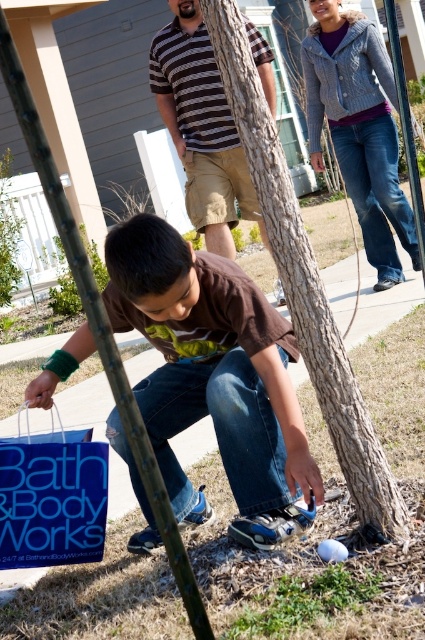
Question: Which object appears closest to the camera in this image?

Choices:
 (A) blue paper shopping bag at lower left
 (B) brown matte shirt at center
 (C) striped cotton shirt at center

Answer: (B)

Question: Which of the following is the farthest from the observer?

Choices:
 (A) brown textured bark at center
 (B) knitted gray sweater at upper right
 (C) brown matte shirt at center
 (D) striped cotton shirt at center

Answer: (B)

Question: Is knitted gray sweater at upper right above striped cotton shirt at center?

Choices:
 (A) no
 (B) yes

Answer: (B)

Question: Is brown textured bark at center closer to the viewer compared to blue paper shopping bag at lower left?

Choices:
 (A) no
 (B) yes

Answer: (B)

Question: Which of the following is the farthest from the observer?

Choices:
 (A) (212, 406)
 (B) (382, 179)

Answer: (B)

Question: Does brown textured bark at center have a larger size compared to knitted gray sweater at upper right?

Choices:
 (A) yes
 (B) no

Answer: (B)